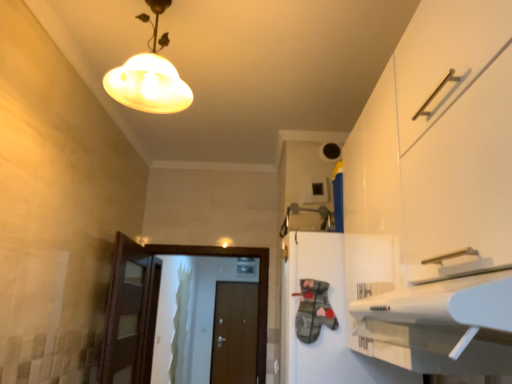
Question: In the image, is white glossy door at center, placed as the second door when sorted from bottom to top, on the left side or the right side of matte glass lampshade at upper center?

Choices:
 (A) left
 (B) right

Answer: (A)

Question: Based on their sizes in the image, would you say white glossy door at center, which ranks as the first door in top-to-bottom order, is bigger or smaller than matte glass lampshade at upper center?

Choices:
 (A) big
 (B) small

Answer: (A)

Question: Considering the real-world distances, which object is closest to the brown matte door at center, which is the second door in front-to-back order?

Choices:
 (A) white matte cabinet at center
 (B) matte glass lampshade at upper center
 (C) white glossy door at center, which ranks as the first door in top-to-bottom order

Answer: (C)

Question: Which object is the farthest from the white matte cabinet at center?

Choices:
 (A) white glossy door at center, which ranks as the first door in top-to-bottom order
 (B) brown matte door at center, which appears as the first door when viewed from the back
 (C) matte glass lampshade at upper center

Answer: (B)